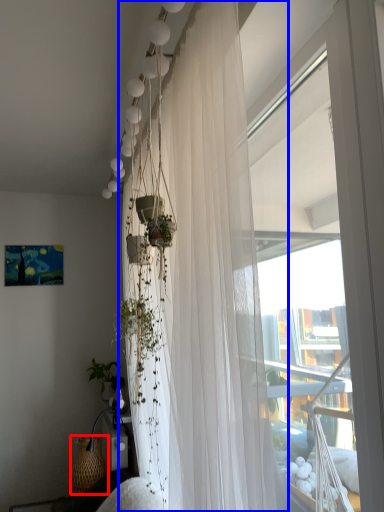
Question: Which object is closer to the camera taking this photo, basket (highlighted by a red box) or curtain (highlighted by a blue box)?

Choices:
 (A) basket
 (B) curtain

Answer: (B)